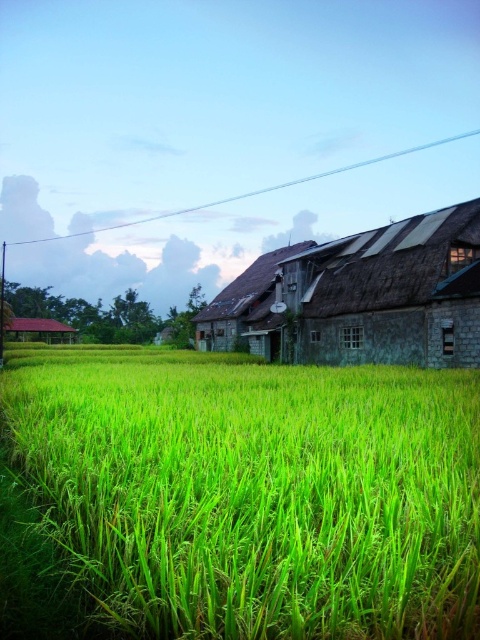
Looking at this image, can you confirm if green grassy field at center is thinner than rusty corrugated metal barn at center?

Yes, green grassy field at center is thinner than rusty corrugated metal barn at center.

In the scene shown: Between green grassy field at center and rusty corrugated metal barn at center, which one has more height?

With more height is rusty corrugated metal barn at center.

Which is in front, point (294, 420) or point (436, 228)?

Point (294, 420) is more forward.

Locate an element on the screen. The height and width of the screenshot is (640, 480). green grassy field at center is located at coordinates (254, 492).